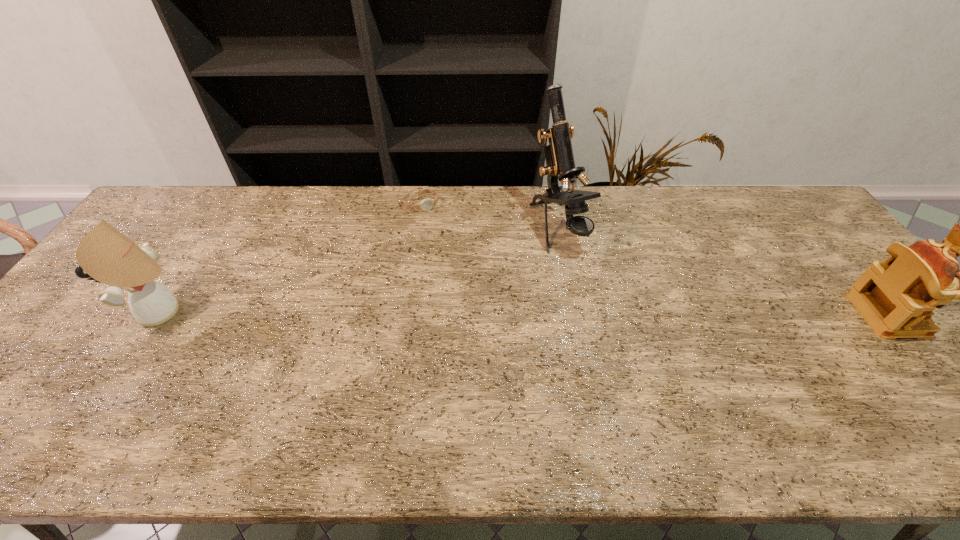
I want to click on free space located through the eyepiece of the second object from right to left, so click(603, 294).

At what (x,y) coordinates should I click in order to perform the action: click on blank space located through the eyepiece of the second object from right to left. Please return your answer as a coordinate pair (x, y). The image size is (960, 540). Looking at the image, I should click on (588, 275).

Locate an element on the screen. The height and width of the screenshot is (540, 960). free location located 0.360m on the face of the shortest object is located at coordinates (471, 285).

I want to click on vacant space situated on the face of the shortest object, so click(x=461, y=266).

The image size is (960, 540). In order to click on free space located 0.180m on the face of the shortest object in this screenshot , I will do `click(447, 246)`.

Where is `microscope that is at the far edge`? The width and height of the screenshot is (960, 540). microscope that is at the far edge is located at coordinates (559, 157).

The width and height of the screenshot is (960, 540). Identify the location of watch that is at the far edge. (426, 204).

Where is `object that is positioned at the right edge`? The width and height of the screenshot is (960, 540). object that is positioned at the right edge is located at coordinates (896, 297).

Image resolution: width=960 pixels, height=540 pixels. Find the location of `free space at the far edge of the desktop`. free space at the far edge of the desktop is located at coordinates (714, 192).

In the image, there is a desktop. At what (x,y) coordinates should I click in order to perform the action: click on vacant space at the near edge. Please return your answer as a coordinate pair (x, y). Looking at the image, I should click on (102, 406).